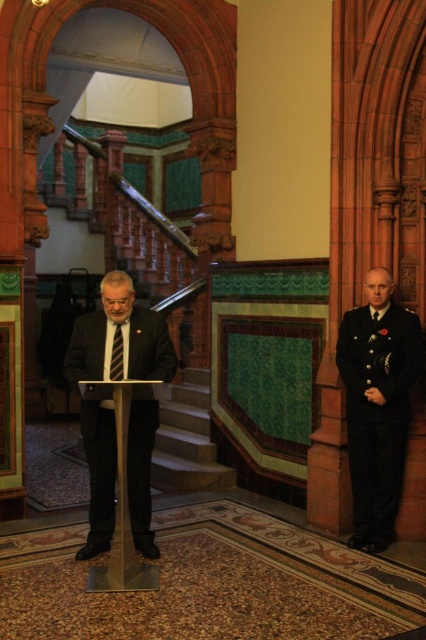
Is point (104, 412) behind point (126, 406)?

Yes, it is behind point (126, 406).

Which is in front, point (104, 529) or point (118, 477)?

Point (118, 477) is more forward.

This screenshot has height=640, width=426. Describe the element at coordinates (123, 337) in the screenshot. I see `dark suit at center` at that location.

This screenshot has height=640, width=426. I want to click on dark suit at center, so tap(123, 337).

Can you confirm if dark suit at center is positioned below dark blue uniform at right?

Correct, dark suit at center is located below dark blue uniform at right.

In order to click on dark suit at center in this screenshot , I will do `click(123, 337)`.

This screenshot has height=640, width=426. Find the location of `dark suit at center`. dark suit at center is located at coordinates (123, 337).

Is stone stairs at center to the right of black silk tie at center from the viewer's perspective?

Yes, stone stairs at center is to the right of black silk tie at center.

Is point (170, 413) positioned before point (118, 369)?

No, it is not.

You are a GUI agent. You are given a task and a screenshot of the screen. Output one action in this format:
    pyautogui.click(x=<x>, y=<y>)
    Task: Click on the stone stairs at center
    This screenshot has width=426, height=640.
    Given the screenshot: What is the action you would take?
    pyautogui.click(x=187, y=440)